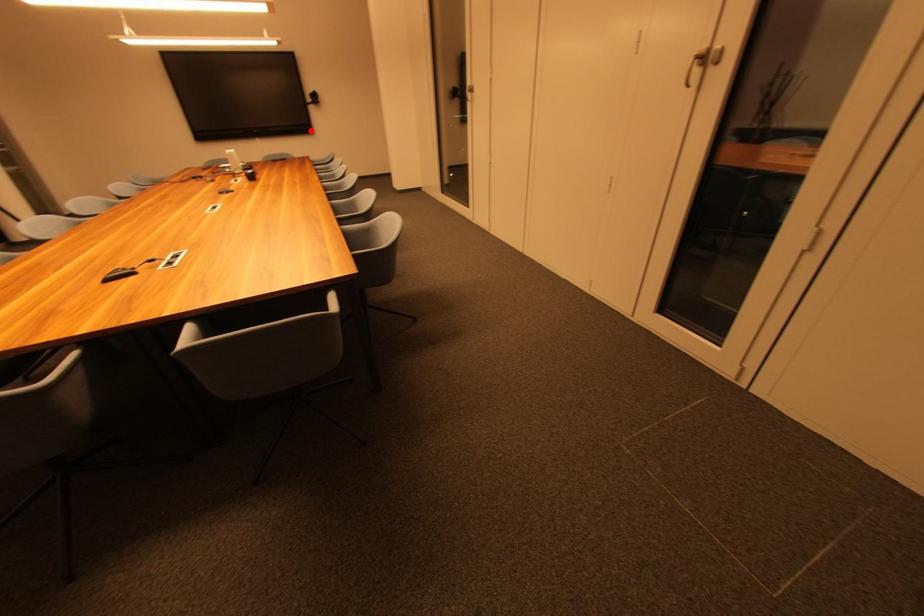
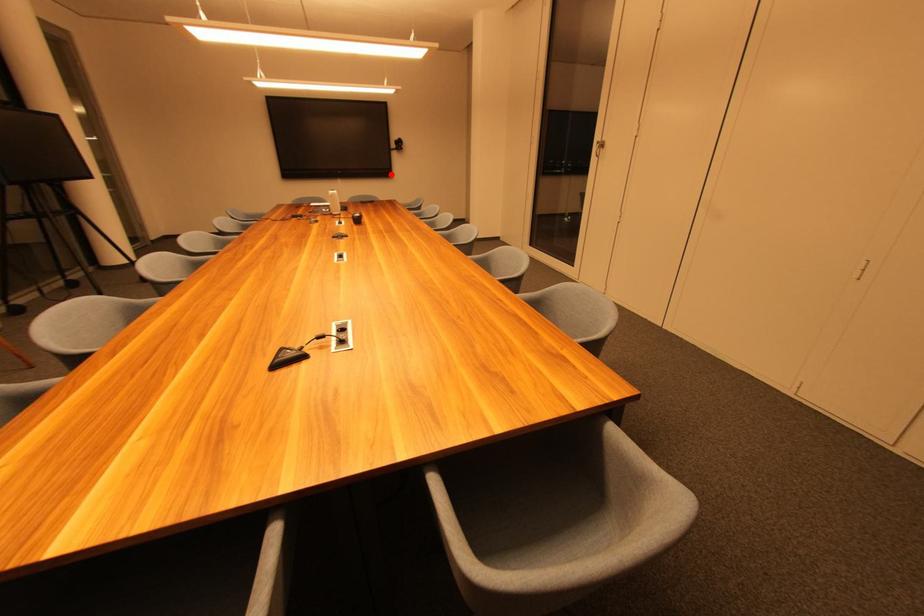
I am providing you with two images of the same scene from different viewpoints. A red point is marked on the first image and another point is marked on the second image. Do the highlighted points in image1 and image2 indicate the same real-world spot?

Yes